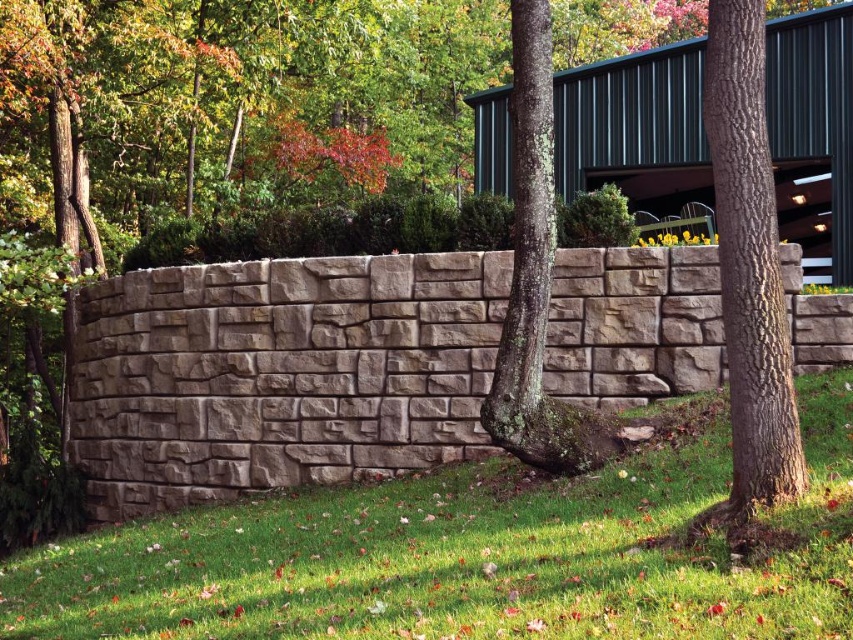
Question: Which is nearer to the brown rough bark tree at center-right?

Choices:
 (A) gray stone wall at center
 (B) lichen-covered bark tree at center

Answer: (B)

Question: Which of the following is the farthest from the observer?

Choices:
 (A) lichen-covered bark tree at center
 (B) green grass at center

Answer: (A)

Question: Can you confirm if green grass at center is positioned above gray stone wall at center?

Choices:
 (A) no
 (B) yes

Answer: (A)

Question: Is green grass at center bigger than lichen-covered bark tree at center?

Choices:
 (A) no
 (B) yes

Answer: (A)

Question: Among these objects, which one is farthest from the camera?

Choices:
 (A) green grass at center
 (B) lichen-covered bark tree at center
 (C) brown rough bark tree at center-right

Answer: (B)

Question: Is green grass at center bigger than lichen-covered bark tree at center?

Choices:
 (A) no
 (B) yes

Answer: (A)